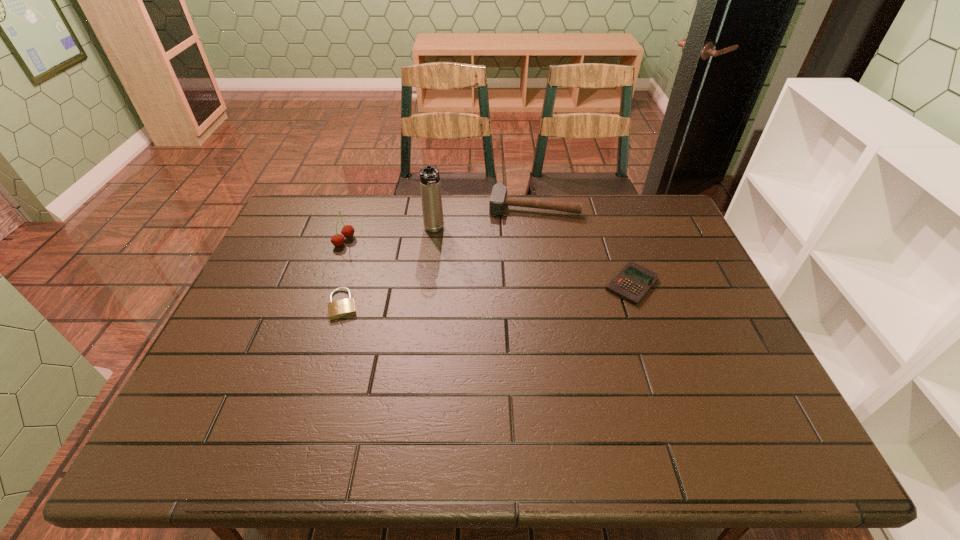
Identify the location of the shortest object. This screenshot has height=540, width=960. (338, 309).

The image size is (960, 540). I want to click on the rightmost object, so click(x=632, y=283).

Where is `calculator`? calculator is located at coordinates (632, 283).

Locate an element on the screen. This screenshot has height=540, width=960. the second tallest object is located at coordinates (347, 231).

I want to click on the tallest object, so click(x=430, y=186).

I want to click on the third object from left to right, so click(x=430, y=186).

Where is `the farthest object`? The image size is (960, 540). the farthest object is located at coordinates (498, 200).

Locate an element on the screen. the second object from right to left is located at coordinates (498, 200).

The width and height of the screenshot is (960, 540). I want to click on vacant space located on the front of the shortest object, so click(316, 397).

The image size is (960, 540). In order to click on vacant space situated 0.360m on the left of the rightmost object in this screenshot , I will do `click(479, 284)`.